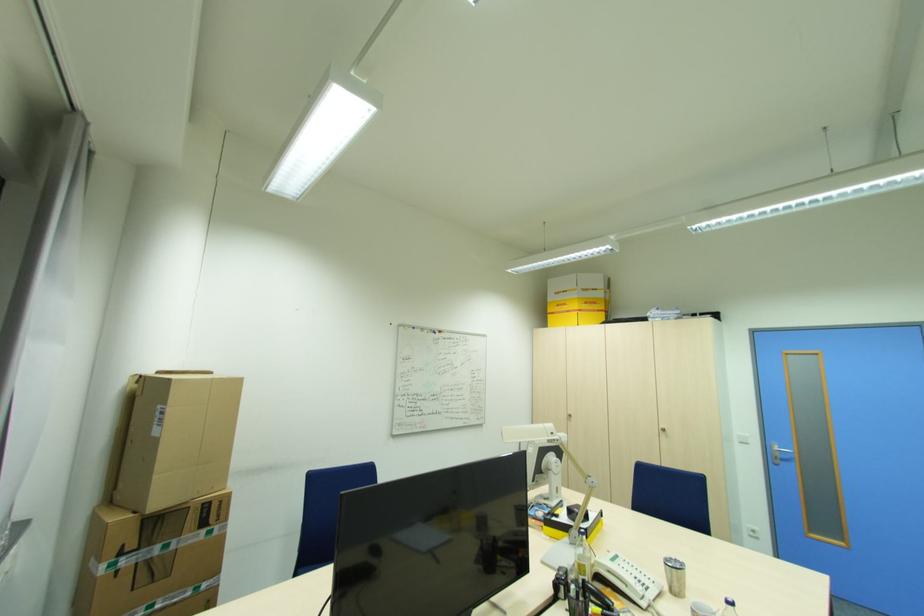
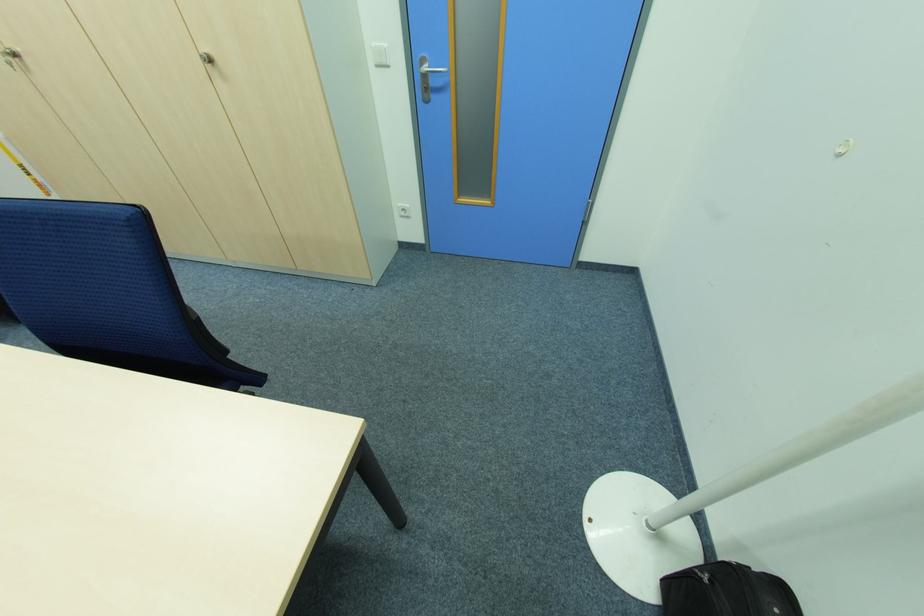
Locate, in the second image, the point that corresponds to pixel 570 418 in the first image.

(14, 65)